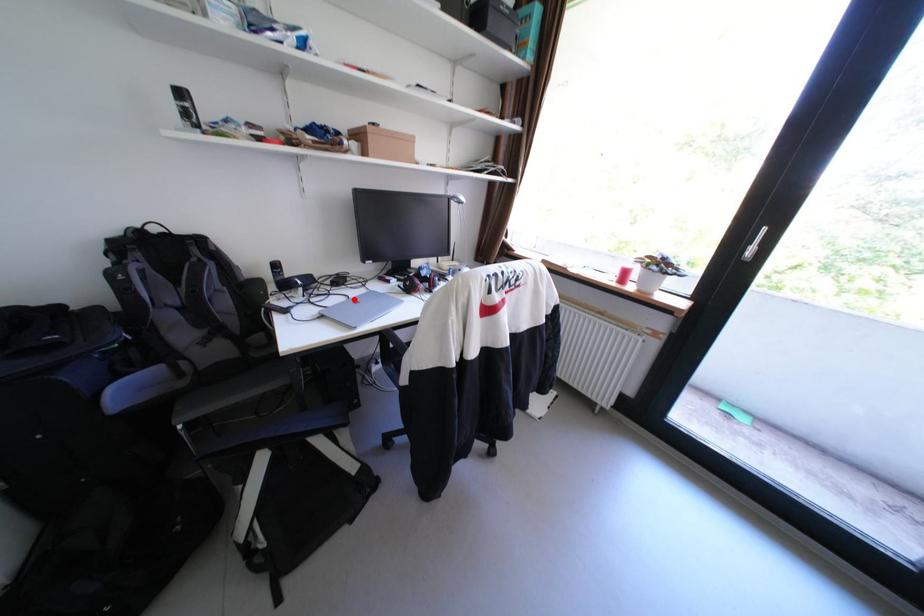
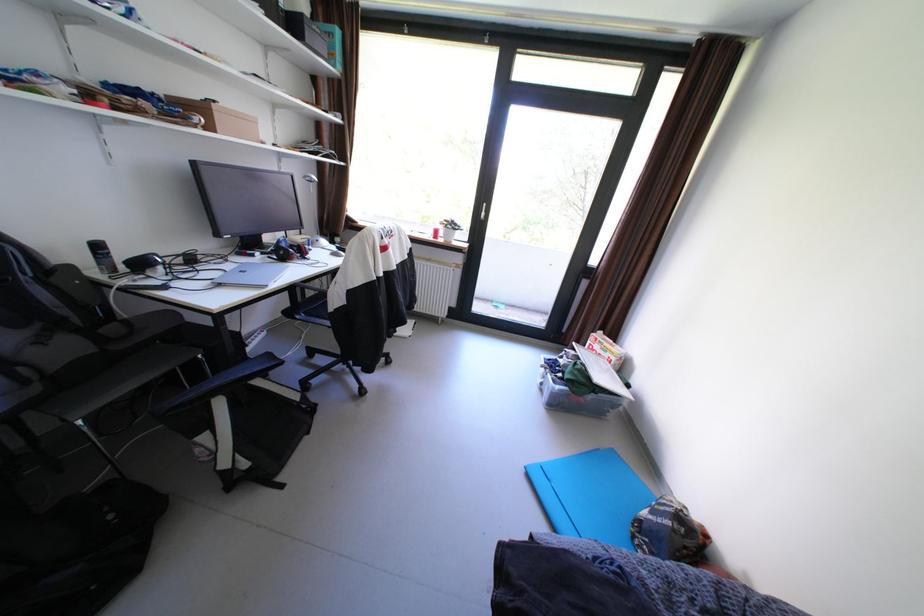
The point at the highlighted location is marked in the first image. Where is the corresponding point in the second image?

(229, 273)